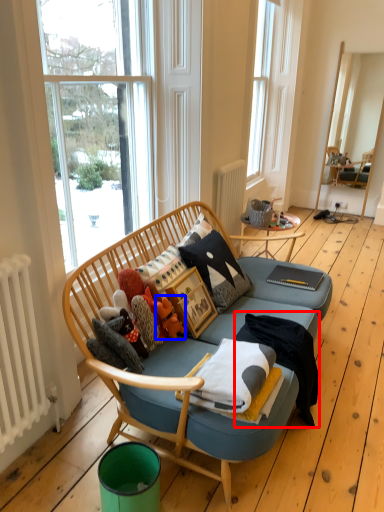
Question: Among these objects, which one is nearest to the camera, blanket (highlighted by a red box) or toy (highlighted by a blue box)?

Choices:
 (A) blanket
 (B) toy

Answer: (A)